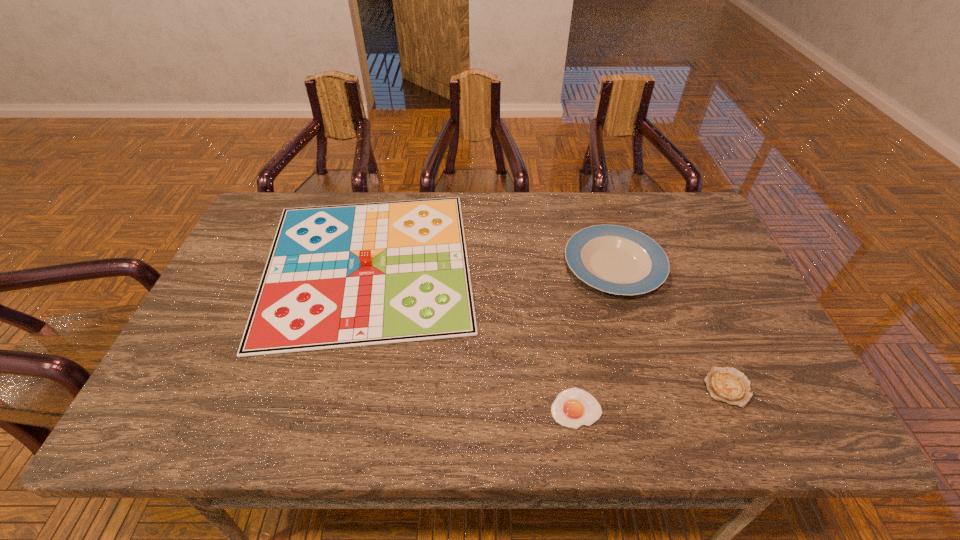
Find the location of a particular element. the leftmost object is located at coordinates (337, 276).

Locate an element on the screen. gameboard is located at coordinates (337, 276).

Where is `plate`? The width and height of the screenshot is (960, 540). plate is located at coordinates (615, 259).

Find the location of a particular element. This screenshot has width=960, height=540. the third tallest object is located at coordinates (728, 385).

Identify the location of egg yolk. This screenshot has width=960, height=540. (574, 407).

What are the coordinates of `vacant space situated on the front of the leftmost object` in the screenshot? It's located at (324, 435).

Identify the location of vacant area located 0.100m on the back of the third shortest object. The width and height of the screenshot is (960, 540). (598, 213).

The height and width of the screenshot is (540, 960). What are the coordinates of `free region located 0.100m on the left of the second shortest object` in the screenshot? It's located at (660, 388).

The width and height of the screenshot is (960, 540). Identify the location of free space located 0.170m on the right of the egg yolk. (680, 408).

In order to click on gameboard positioned at the far edge in this screenshot , I will do `click(337, 276)`.